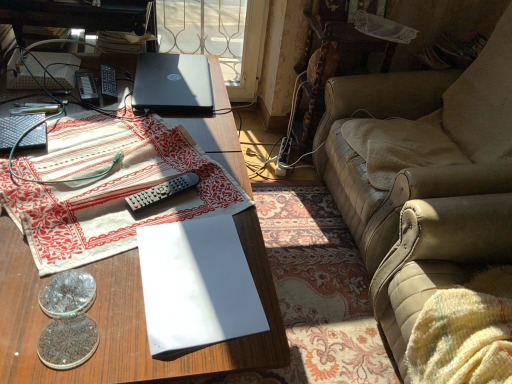
This screenshot has height=384, width=512. Find the location of `vacant space in between white paper at left, the first paperback book from the left, and shiny metallic coin at lower left, placed as the second coin when sorted from front to back`. vacant space in between white paper at left, the first paperback book from the left, and shiny metallic coin at lower left, placed as the second coin when sorted from front to back is located at coordinates (52, 157).